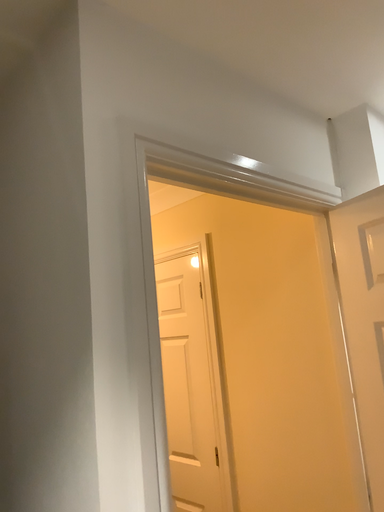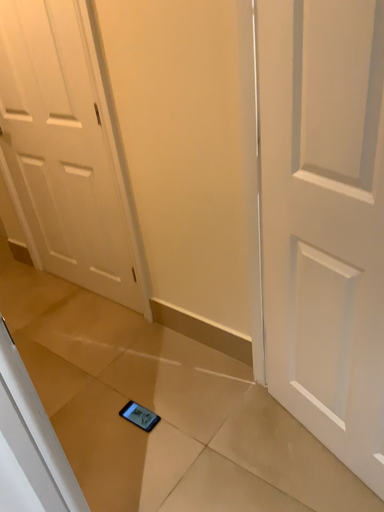
Question: How did the camera likely rotate when shooting the video?

Choices:
 (A) rotated left
 (B) rotated right

Answer: (B)